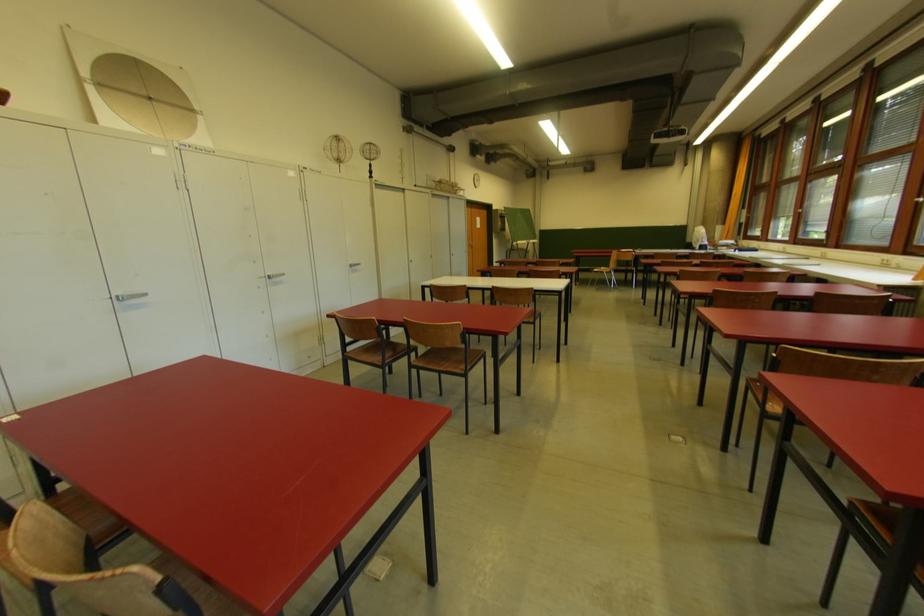
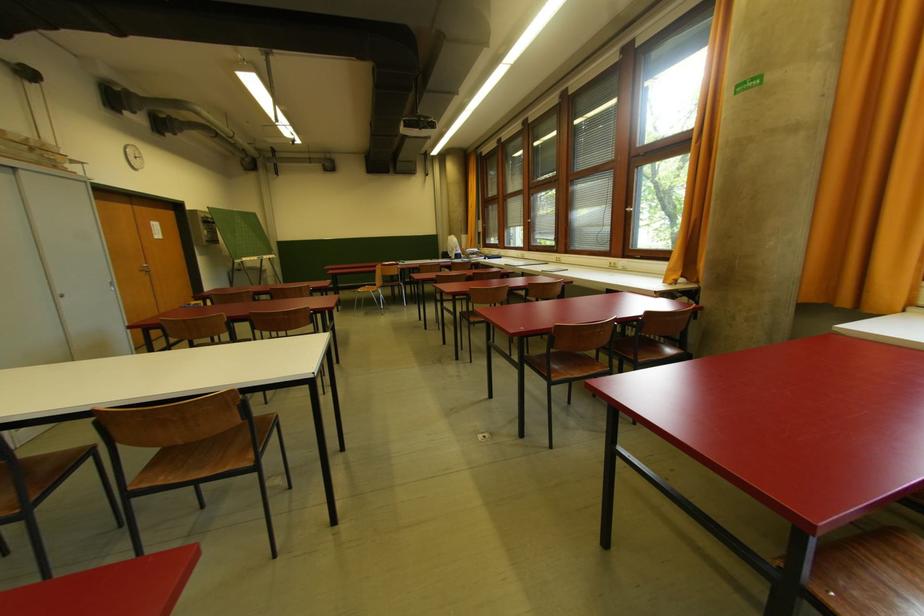
Locate, in the second image, the point that corresponds to [533,322] in the first image.

(250, 467)